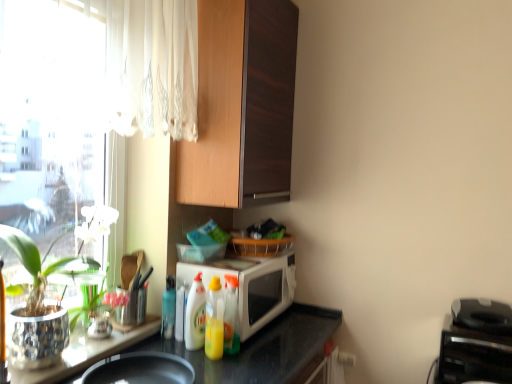
Question: Is translucent plastic bottle at center, positioned as the 4th bottle in left-to-right order, oriented towards black plastic toaster at lower right?

Choices:
 (A) yes
 (B) no

Answer: (B)

Question: From the image's perspective, is translucent plastic bottle at center, acting as the first bottle starting from the right, located beneath black plastic toaster at lower right?

Choices:
 (A) no
 (B) yes

Answer: (A)

Question: Does translucent plastic bottle at center, positioned as the 4th bottle in left-to-right order, have a larger size compared to black plastic toaster at lower right?

Choices:
 (A) no
 (B) yes

Answer: (A)

Question: Is translucent plastic bottle at center, acting as the first bottle starting from the right, completely or partially outside of black plastic toaster at lower right?

Choices:
 (A) yes
 (B) no

Answer: (A)

Question: Is translucent plastic bottle at center, positioned as the 4th bottle in left-to-right order, wider than black plastic toaster at lower right?

Choices:
 (A) no
 (B) yes

Answer: (A)

Question: Would you say translucent plastic bottle at center, positioned as the 4th bottle in left-to-right order, is to the left or to the right of yellow translucent bottle at center, the second bottle in the right-to-left sequence, in the picture?

Choices:
 (A) left
 (B) right

Answer: (B)

Question: From a real-world perspective, is translucent plastic bottle at center, acting as the first bottle starting from the right, above or below yellow translucent bottle at center, the second bottle in the right-to-left sequence?

Choices:
 (A) below
 (B) above

Answer: (A)

Question: Looking at the image, does translucent plastic bottle at center, positioned as the 4th bottle in left-to-right order, seem bigger or smaller compared to yellow translucent bottle at center, which appears as the 3th bottle when viewed from the left?

Choices:
 (A) big
 (B) small

Answer: (B)

Question: From their relative heights in the image, would you say translucent plastic bottle at center, positioned as the 4th bottle in left-to-right order, is taller or shorter than yellow translucent bottle at center, the second bottle in the right-to-left sequence?

Choices:
 (A) short
 (B) tall

Answer: (A)

Question: Looking at their shapes, would you say translucent plastic bottle at center, acting as the first bottle starting from the right, is wider or thinner than metallic silver table at lower left?

Choices:
 (A) wide
 (B) thin

Answer: (B)

Question: In the image, is translucent plastic bottle at center, acting as the first bottle starting from the right, on the left side or the right side of metallic silver table at lower left?

Choices:
 (A) right
 (B) left

Answer: (A)

Question: Considering the positions of point (238, 283) and point (79, 362), is point (238, 283) closer or farther from the camera than point (79, 362)?

Choices:
 (A) closer
 (B) farther

Answer: (B)

Question: From the image's perspective, is translucent plastic bottle at center, positioned as the 4th bottle in left-to-right order, located above or below metallic silver table at lower left?

Choices:
 (A) above
 (B) below

Answer: (A)

Question: From a real-world perspective, is wooden cabinet at upper center above or below translucent plastic bottle at center, which is the 1th bottle from left to right?

Choices:
 (A) below
 (B) above

Answer: (B)

Question: Is wooden cabinet at upper center in front of or behind translucent plastic bottle at center, marked as the 4th bottle in a right-to-left arrangement, in the image?

Choices:
 (A) front
 (B) behind

Answer: (A)